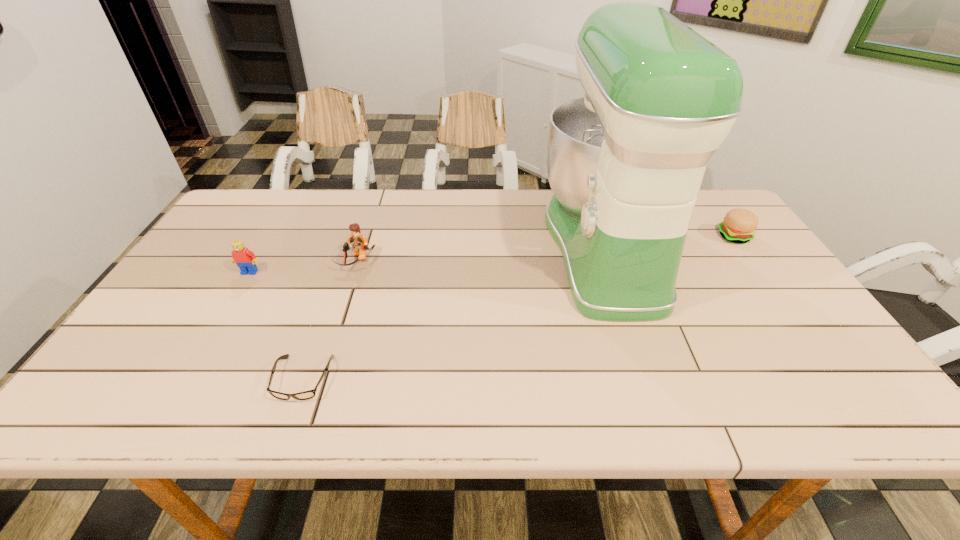
The width and height of the screenshot is (960, 540). Identify the location of the tallest object. (625, 163).

This screenshot has height=540, width=960. I want to click on the fourth object from left to right, so click(x=625, y=163).

Where is `the right Lego`? This screenshot has height=540, width=960. the right Lego is located at coordinates (357, 242).

Locate an element on the screen. The width and height of the screenshot is (960, 540). the left Lego is located at coordinates (245, 259).

This screenshot has height=540, width=960. I want to click on the second shortest object, so click(x=739, y=225).

Identify the location of hamburger. This screenshot has height=540, width=960. (739, 225).

This screenshot has height=540, width=960. What are the coordinates of `the shortest object` in the screenshot? It's located at (306, 395).

Find the location of a particular element. spectacles is located at coordinates (306, 395).

Where is `vacant area located 0.240m on the controls of the tallest object`? The width and height of the screenshot is (960, 540). vacant area located 0.240m on the controls of the tallest object is located at coordinates (461, 248).

This screenshot has width=960, height=540. Identify the location of vacant region located 0.400m on the controls of the tallest object. (406, 248).